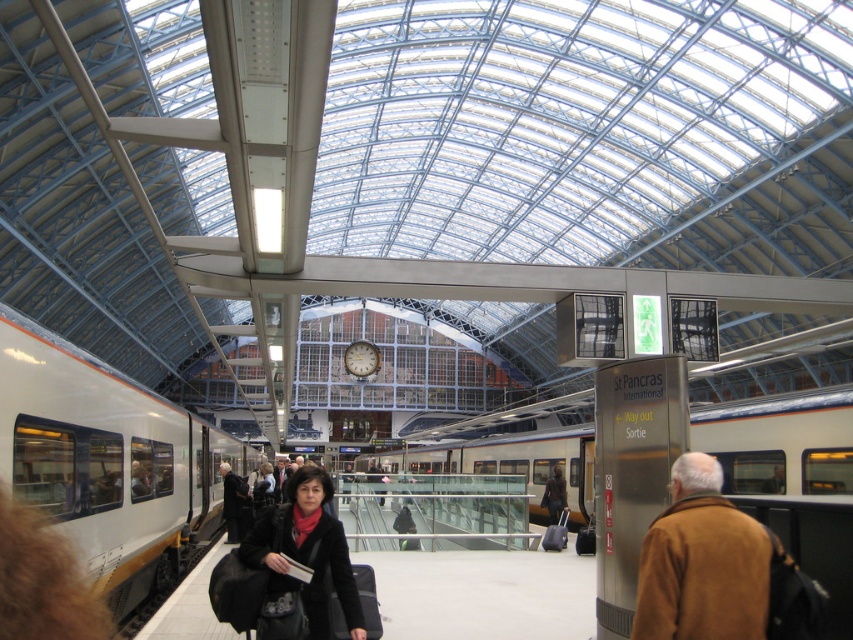
You are a traveler with a 10 meter long luggage cart. You are standing at the silver metallic train at center and want to move towards the brown leather jacket at lower right. Can your cart fit through the space between them without any obstruction?

The distance between the silver metallic train at center and the brown leather jacket at lower right is 10.69 meters. Since your luggage cart is 10 meters long, it can fit through the space between them as there is enough clearance.

You are a traveler at St Pancras International station and want to board the silver metallic train at center. You are currently standing at the brown leather jacket at lower right. Can you directly walk towards the train without moving around any objects or people?

The silver metallic train at center is positioned under brown leather jacket at lower right, so you are already standing above the train and can walk straight down towards it without needing to move around any objects or people.

You are a traveler at St Pancras International station and you see two coats in the crowd. The first is a brown leather jacket at lower right and the second is a velvet black coat at center. Which coat is positioned more to the east side of the station?

The brown leather jacket at lower right is positioned more to the east side of the station because it is to the right of the velvet black coat at center, and in the station layout, right typically corresponds to east.